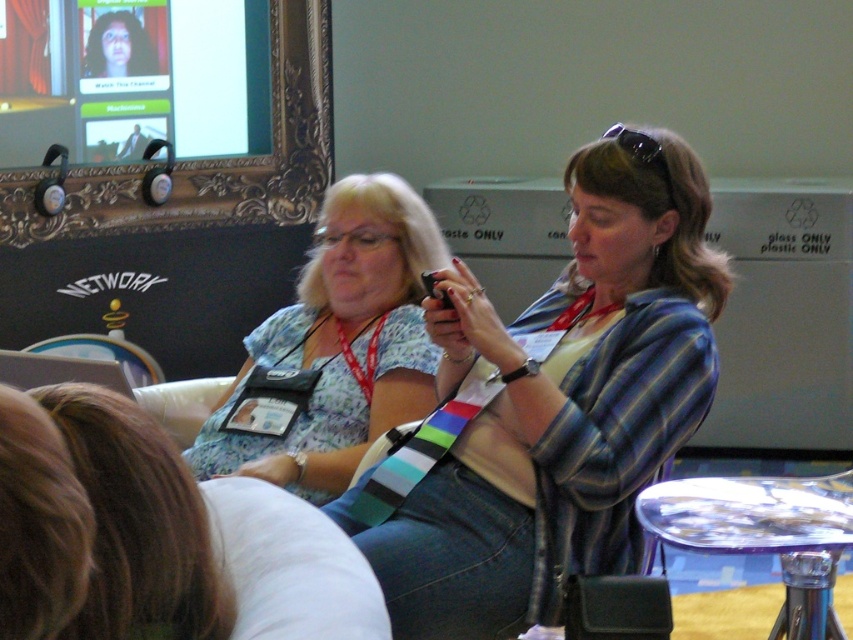
Question: Is brown hair at lower left thinner than transparent plastic stool at lower right?

Choices:
 (A) no
 (B) yes

Answer: (B)

Question: Can you confirm if striped fabric shirt at center is positioned below brown hair at lower left?

Choices:
 (A) yes
 (B) no

Answer: (B)

Question: Does striped fabric shirt at center have a greater width compared to floral fabric blouse at center?

Choices:
 (A) no
 (B) yes

Answer: (B)

Question: Which is nearer to the transparent plastic stool at lower right?

Choices:
 (A) floral fabric blouse at center
 (B) striped fabric shirt at center
 (C) brown hair at lower left

Answer: (B)

Question: Among these points, which one is nearest to the camera?

Choices:
 (A) click(842, 525)
 (B) click(357, 541)
 (C) click(363, 248)

Answer: (A)

Question: Which object appears farthest from the camera in this image?

Choices:
 (A) transparent plastic stool at lower right
 (B) brown hair at lower left
 (C) striped fabric shirt at center
 (D) floral fabric blouse at center

Answer: (D)